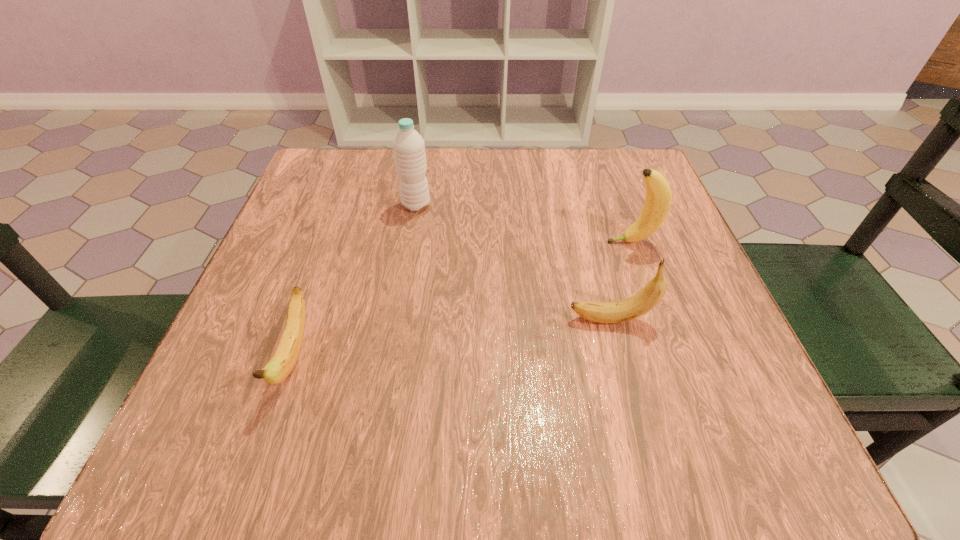
I want to click on the second object from left to right, so click(408, 146).

This screenshot has width=960, height=540. In order to click on the farthest object in this screenshot , I will do `click(408, 146)`.

Find the location of a particular element. the second farthest object is located at coordinates (658, 198).

Where is `the farthest banana`? the farthest banana is located at coordinates (658, 198).

Where is `the third tallest object`? This screenshot has width=960, height=540. the third tallest object is located at coordinates (651, 294).

Locate an element on the screen. Image resolution: width=960 pixels, height=540 pixels. the leftmost banana is located at coordinates pos(282,363).

I want to click on the shortest object, so click(282, 363).

Identify the location of free location located on the right of the water bottle. (511, 205).

Find the location of a particular element. This screenshot has width=960, height=540. vacant space located 0.310m from the stem of the farthest banana is located at coordinates (455, 242).

The height and width of the screenshot is (540, 960). In order to click on blank space located from the stem of the farthest banana in this screenshot , I will do `click(523, 242)`.